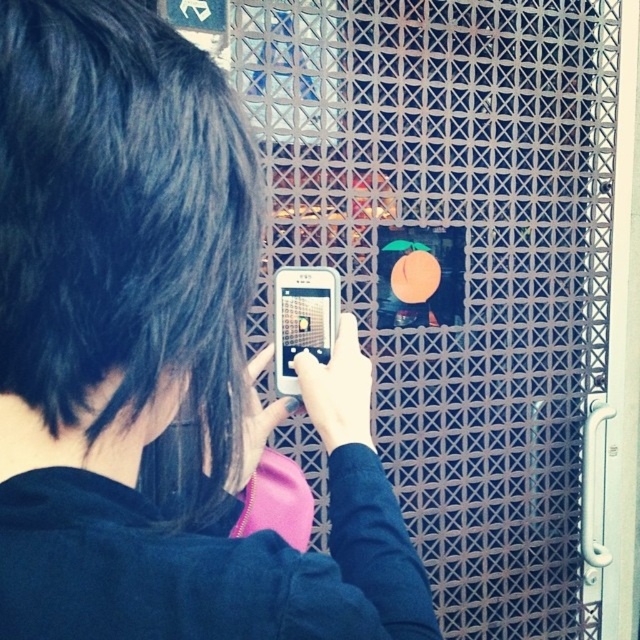
Between black matte phone at center and white matte smartphone at center, which one appears on the right side from the viewer's perspective?

From the viewer's perspective, white matte smartphone at center appears more on the right side.

Which is more to the left, black matte phone at center or white matte smartphone at center?

From the viewer's perspective, black matte phone at center appears more on the left side.

Locate an element on the screen. The width and height of the screenshot is (640, 640). black matte phone at center is located at coordinates 157,360.